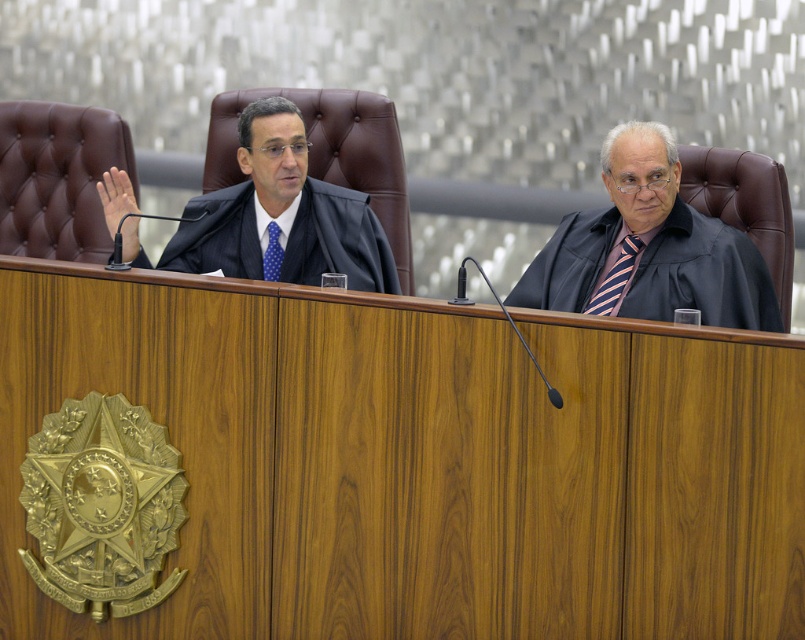
Question: Can you confirm if matte black robe at left is thinner than striped fabric tie at right?

Choices:
 (A) yes
 (B) no

Answer: (B)

Question: Which point is farther to the camera?

Choices:
 (A) blue dotted tie at center
 (B) striped fabric tie at right
 (C) matte black robe at right
 (D) matte black robe at left

Answer: (A)

Question: Is matte black robe at right bigger than matte black robe at left?

Choices:
 (A) no
 (B) yes

Answer: (B)

Question: Which point is farther to the camera?

Choices:
 (A) (316, 204)
 (B) (263, 276)
 (C) (673, 262)

Answer: (A)

Question: Which object is closer to the camera taking this photo?

Choices:
 (A) matte black robe at right
 (B) matte black robe at left
 (C) striped fabric tie at right
 (D) blue dotted tie at center

Answer: (A)

Question: Can you confirm if matte black robe at right is positioned to the left of blue dotted tie at center?

Choices:
 (A) yes
 (B) no

Answer: (B)